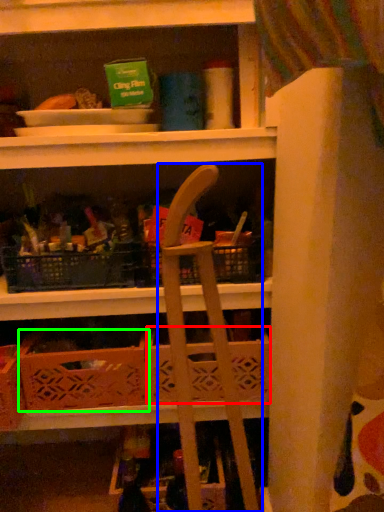
Question: Which object is positioned closest to basket (highlighted by a red box)? Select from folding chair (highlighted by a blue box) and crate (highlighted by a green box).

Choices:
 (A) folding chair
 (B) crate

Answer: (A)